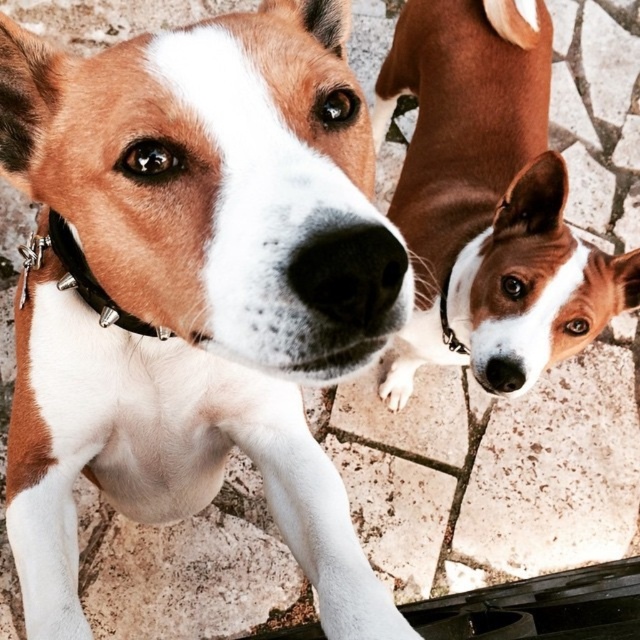
Question: Can you confirm if brown and white fur at center is smaller than black studded leather at center?

Choices:
 (A) no
 (B) yes

Answer: (A)

Question: Is black smooth nose at center smaller than black studded leather at center?

Choices:
 (A) yes
 (B) no

Answer: (A)

Question: Which point is closer to the camera?

Choices:
 (A) black smooth nose at center
 (B) brown/white fur dog at upper right
 (C) black rubber nose at upper center

Answer: (A)

Question: Is the position of black smooth nose at center more distant than that of black rubber nose at upper center?

Choices:
 (A) no
 (B) yes

Answer: (A)

Question: Which object appears closest to the camera in this image?

Choices:
 (A) black studded leather at center
 (B) black rubber nose at upper center

Answer: (A)

Question: Among these objects, which one is farthest from the camera?

Choices:
 (A) black rubber nose at upper center
 (B) brown and white fur at center
 (C) black smooth nose at center
 (D) white soft fur paw at upper right

Answer: (D)